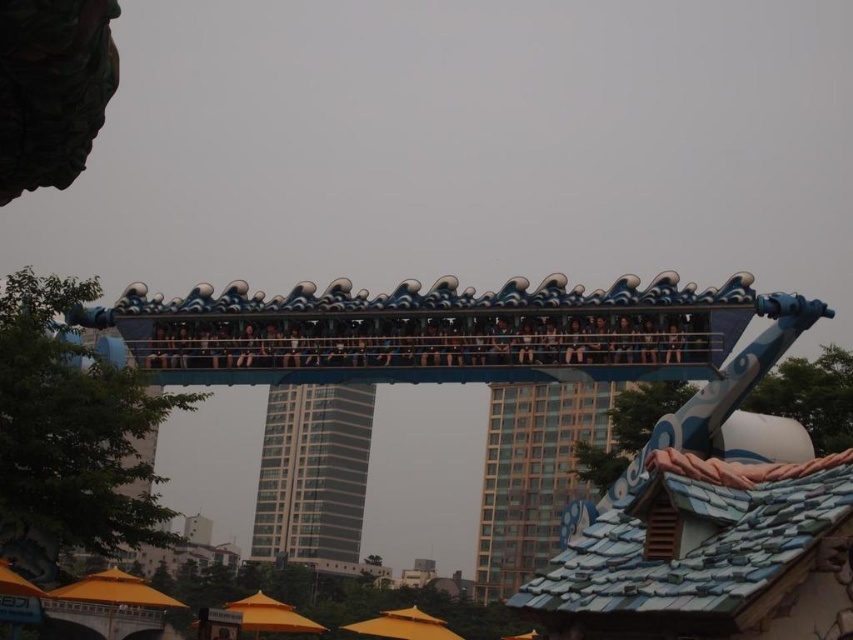
You are a maintenance worker needing to inspect the blue glossy roller coaster at center and the blue fabric seats at center. If your ladder can reach up to 8 meters, can you safely inspect both objects without moving the ladder?

The distance between the blue glossy roller coaster at center and the blue fabric seats at center is 8.25 meters. Since the ladder can only reach up to 8 meters, you cannot safely inspect both objects without moving the ladder because the distance exceeds the ladder reach.

You are standing at the entrance of the theme park and want to take a photo of the blue glossy roller coaster at center. Based on its position, where should you position yourself to capture it in the frame?

The blue glossy roller coaster at center is located at point (711, 520), so you should position yourself at the entrance and aim your camera towards the center area to capture it in the frame.

You are a visitor at the theme park and want to take a photo of the blue glossy roller coaster at center without any obstruction. Since the blue fabric seats at center might block your view, can you confirm if the roller coaster is visible from below the seats?

The blue glossy roller coaster at center is positioned under the blue fabric seats at center, so it should be visible from below the seats without obstruction.